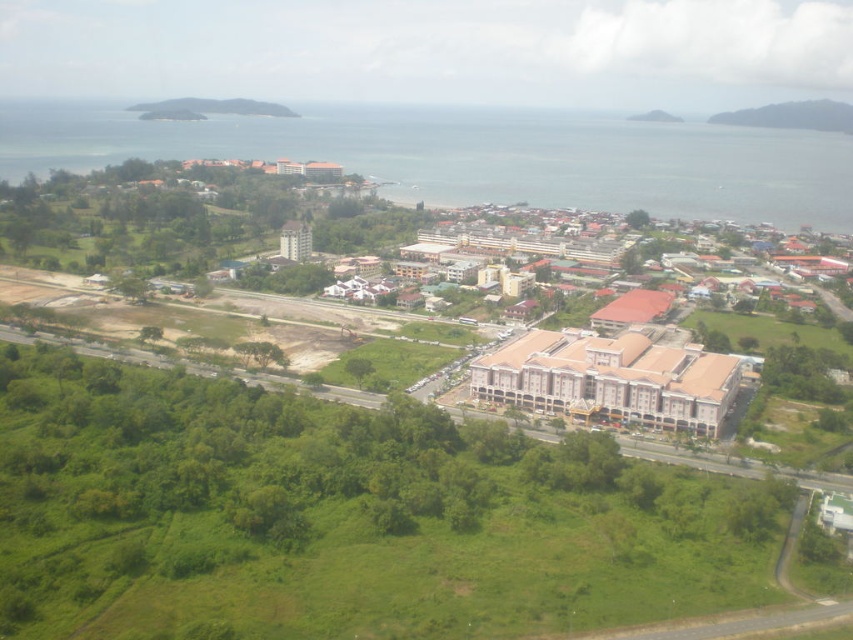
Question: Is brown/brick building at center positioned behind green grassy hillside at upper left?

Choices:
 (A) yes
 (B) no

Answer: (B)

Question: Does green grassy hillside at upper right appear under green grassy hillside at upper left?

Choices:
 (A) no
 (B) yes

Answer: (B)

Question: Based on their relative distances, which object is farther from the green grassy hillside at upper right?

Choices:
 (A) green grass at bottom left
 (B) brown/brick building at center
 (C) green grassy hillside at upper left

Answer: (C)

Question: Is brown/brick building at center further to camera compared to green grassy hillside at upper left?

Choices:
 (A) yes
 (B) no

Answer: (B)

Question: Which object appears closest to the camera in this image?

Choices:
 (A) green grassy hillside at upper right
 (B) green grassy hillside at upper left
 (C) green grass at bottom left

Answer: (C)

Question: Which object appears closest to the camera in this image?

Choices:
 (A) green grassy hillside at upper right
 (B) green grass at bottom left
 (C) green grassy hillside at upper left

Answer: (B)